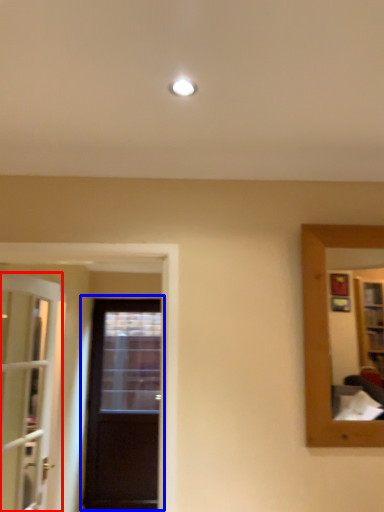
Question: Which point is closer to the camera, door (highlighted by a red box) or door (highlighted by a blue box)?

Choices:
 (A) door
 (B) door

Answer: (A)